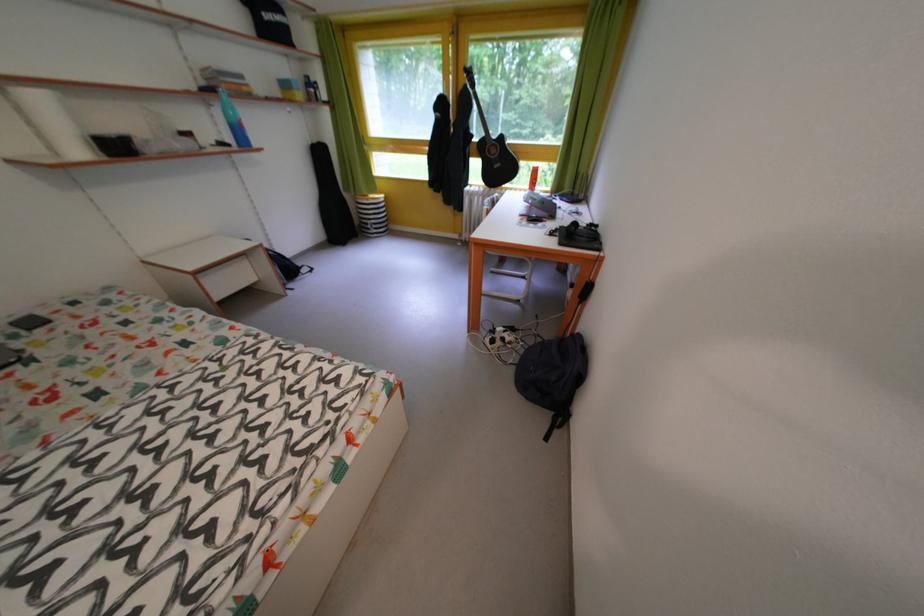
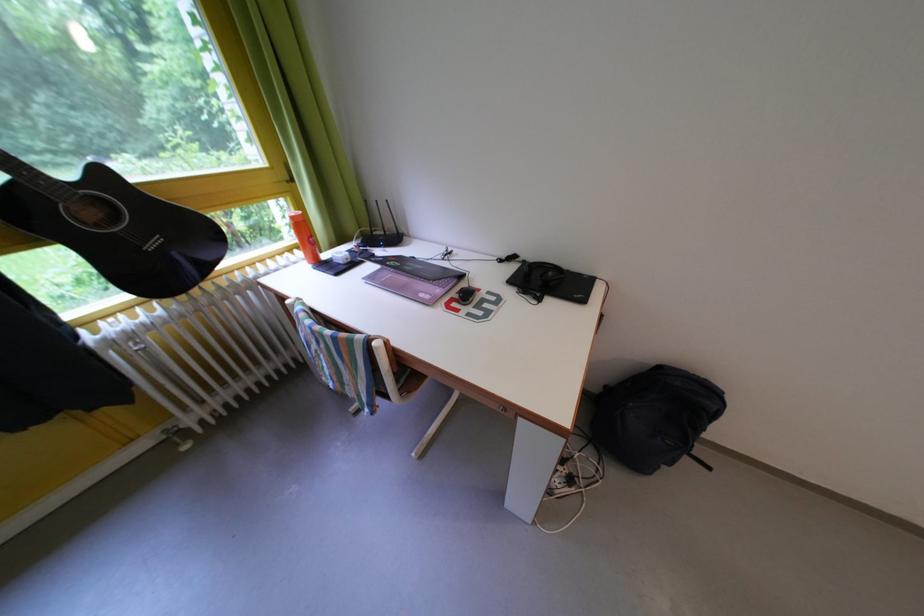
The point at (512, 143) is marked in the first image. Where is the corresponding point in the second image?

(112, 179)